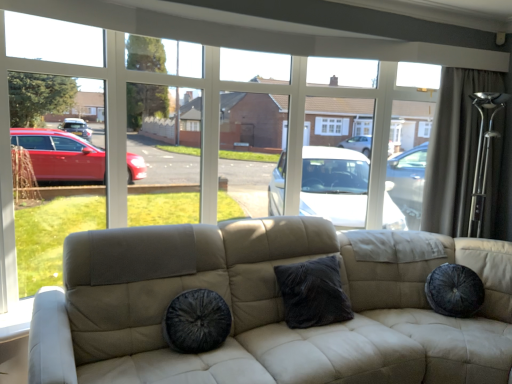
Question: Does velvet dark gray pillow at center have a smaller size compared to velvet black dog bed at center?

Choices:
 (A) no
 (B) yes

Answer: (A)

Question: Does velvet dark gray pillow at center lie in front of velvet black dog bed at center?

Choices:
 (A) yes
 (B) no

Answer: (B)

Question: Is velvet dark gray pillow at center thinner than velvet black dog bed at center?

Choices:
 (A) no
 (B) yes

Answer: (B)

Question: Does velvet dark gray pillow at center touch velvet black dog bed at center?

Choices:
 (A) yes
 (B) no

Answer: (B)

Question: Does velvet dark gray pillow at center have a lesser height compared to velvet black dog bed at center?

Choices:
 (A) yes
 (B) no

Answer: (B)

Question: From their relative heights in the image, would you say velvet dark gray pillow at center is taller or shorter than dark gray fabric curtain at upper right?

Choices:
 (A) tall
 (B) short

Answer: (B)

Question: Looking at the image, does velvet dark gray pillow at center seem bigger or smaller compared to dark gray fabric curtain at upper right?

Choices:
 (A) big
 (B) small

Answer: (B)

Question: From a real-world perspective, is velvet dark gray pillow at center physically located above or below dark gray fabric curtain at upper right?

Choices:
 (A) above
 (B) below

Answer: (B)

Question: Visually, is velvet dark gray pillow at center positioned to the left or to the right of dark gray fabric curtain at upper right?

Choices:
 (A) left
 (B) right

Answer: (A)

Question: From a real-world perspective, relative to velvet dark gray pillow at center, is dark gray fabric curtain at upper right vertically above or below?

Choices:
 (A) above
 (B) below

Answer: (A)

Question: Relative to velvet dark gray pillow at center, is dark gray fabric curtain at upper right in front or behind?

Choices:
 (A) behind
 (B) front

Answer: (A)

Question: In terms of height, does dark gray fabric curtain at upper right look taller or shorter compared to velvet dark gray pillow at center?

Choices:
 (A) tall
 (B) short

Answer: (A)

Question: From the image's perspective, relative to velvet dark gray pillow at center, is dark gray fabric curtain at upper right above or below?

Choices:
 (A) above
 (B) below

Answer: (A)

Question: Is velvet dark gray pillow at center bigger or smaller than velvet black dog bed at center?

Choices:
 (A) small
 (B) big

Answer: (B)

Question: Relative to velvet black dog bed at center, is velvet dark gray pillow at center in front or behind?

Choices:
 (A) behind
 (B) front

Answer: (A)